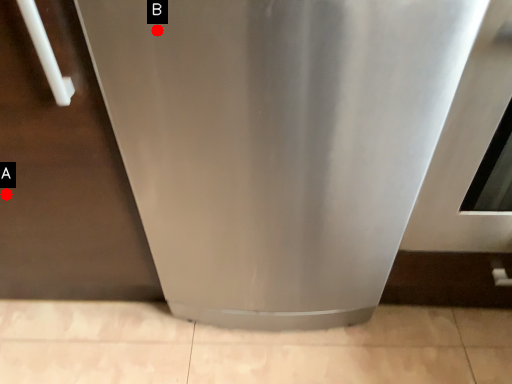
Question: Two points are circled on the image, labeled by A and B beside each circle. Which of the following is the closest to the observer?

Choices:
 (A) A is closer
 (B) B is closer

Answer: (B)